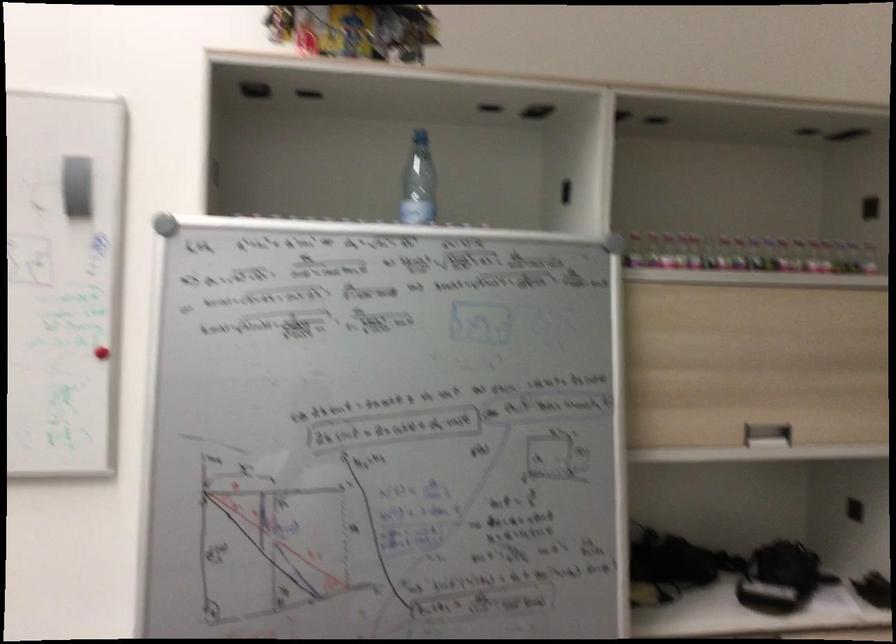
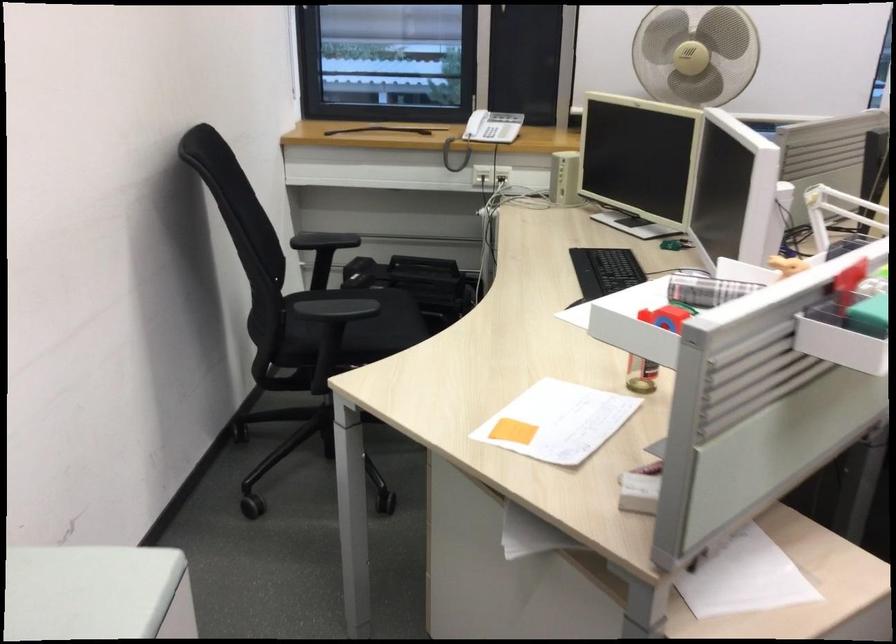
The images are taken continuously from a first-person perspective. In which direction is your viewpoint rotating?

The camera's rotation is toward left-down.